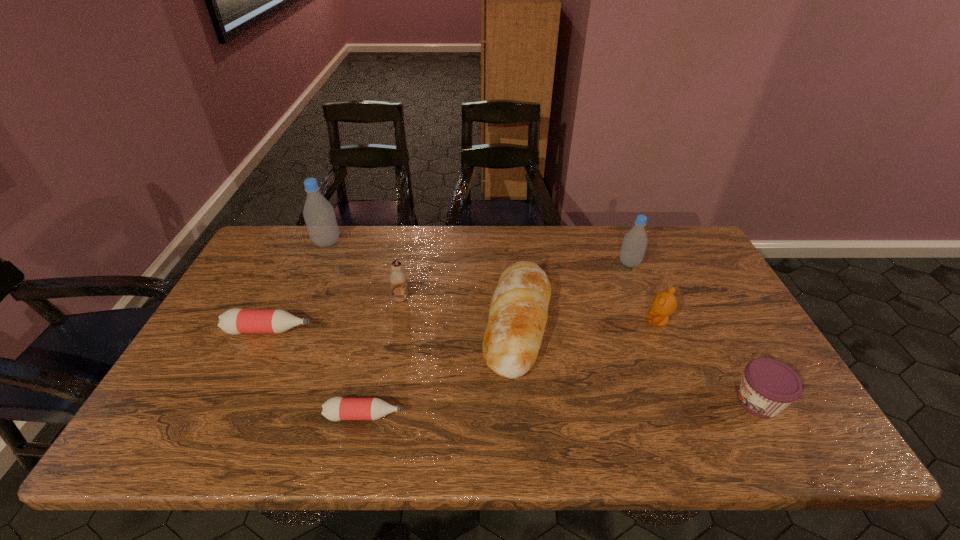
I want to click on the left gray bottle, so click(x=318, y=213).

Find the location of `the farther gray bottle`. the farther gray bottle is located at coordinates (318, 213).

Find the location of a particular element. Image resolution: width=960 pixels, height=540 pixels. the second farthest object is located at coordinates (635, 241).

The image size is (960, 540). What are the coordinates of `the smaller gray bottle` in the screenshot? It's located at (635, 241).

I want to click on chocolate milk, so click(x=398, y=278).

The image size is (960, 540). Find the location of `bread`. bread is located at coordinates (518, 310).

Locate an element on the screen. beige bread is located at coordinates (518, 310).

The width and height of the screenshot is (960, 540). I want to click on teddy bear, so click(x=664, y=304).

Identify the location of the sixth tallest object. The width and height of the screenshot is (960, 540). (768, 386).

You are a GUI agent. You are given a task and a screenshot of the screen. Output one action in this format:
    pyautogui.click(x=<x>, y=<y>)
    Task: Click on the rightmost object
    
    Given the screenshot: What is the action you would take?
    pyautogui.click(x=768, y=386)